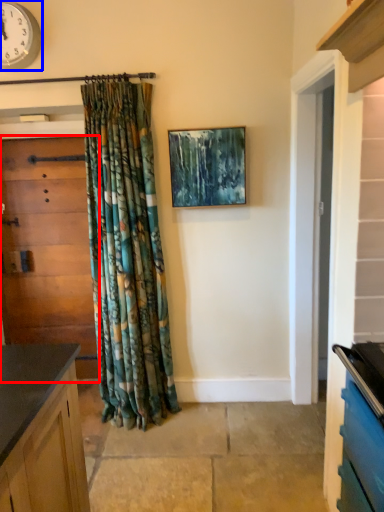
Question: Which object appears farthest to the camera in this image, door (highlighted by a red box) or clock (highlighted by a blue box)?

Choices:
 (A) door
 (B) clock

Answer: (A)